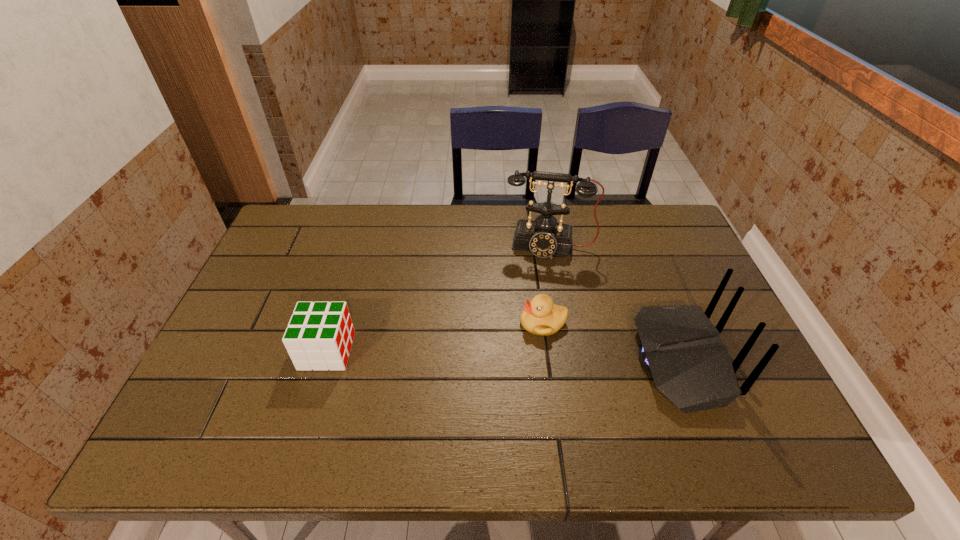
You are a GUI agent. You are given a task and a screenshot of the screen. Output one action in this format:
    pyautogui.click(x=<x>, y=<y>)
    Task: Click on the free space between the leftmost object and the telephone
    The width and height of the screenshot is (960, 540).
    Given the screenshot: What is the action you would take?
    pyautogui.click(x=438, y=298)

Locate an element on the screen. The width and height of the screenshot is (960, 540). vacant area that lies between the telephone and the leftmost object is located at coordinates (438, 298).

Image resolution: width=960 pixels, height=540 pixels. What are the coordinates of `vacant area that lies between the farthest object and the rightmost object` in the screenshot? It's located at (614, 303).

This screenshot has height=540, width=960. In order to click on vacant area between the shortest object and the cube in this screenshot , I will do click(x=435, y=336).

Locate an element on the screen. Image resolution: width=960 pixels, height=540 pixels. the third closest object to the leftmost object is located at coordinates (681, 348).

The height and width of the screenshot is (540, 960). I want to click on object that is the third closest to the third shortest object, so click(319, 336).